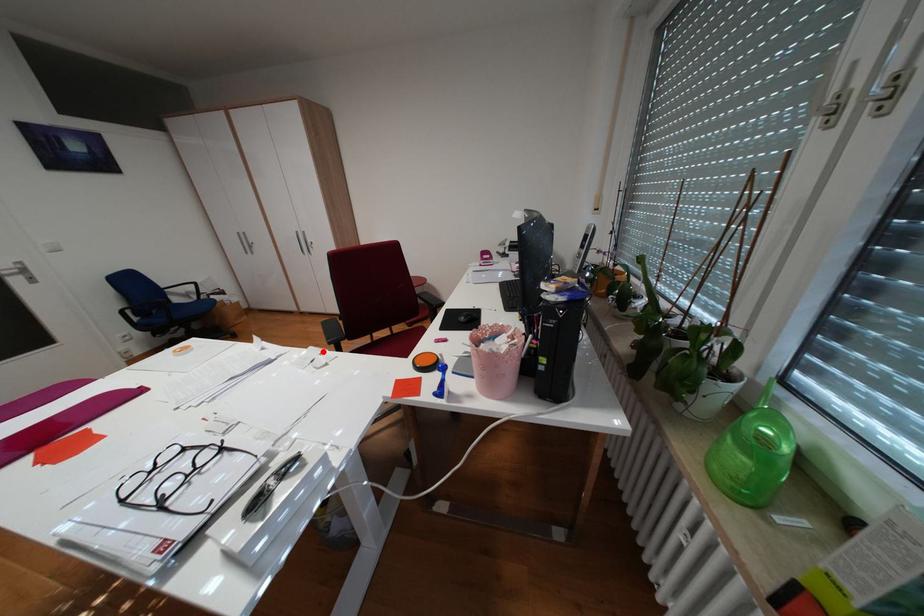
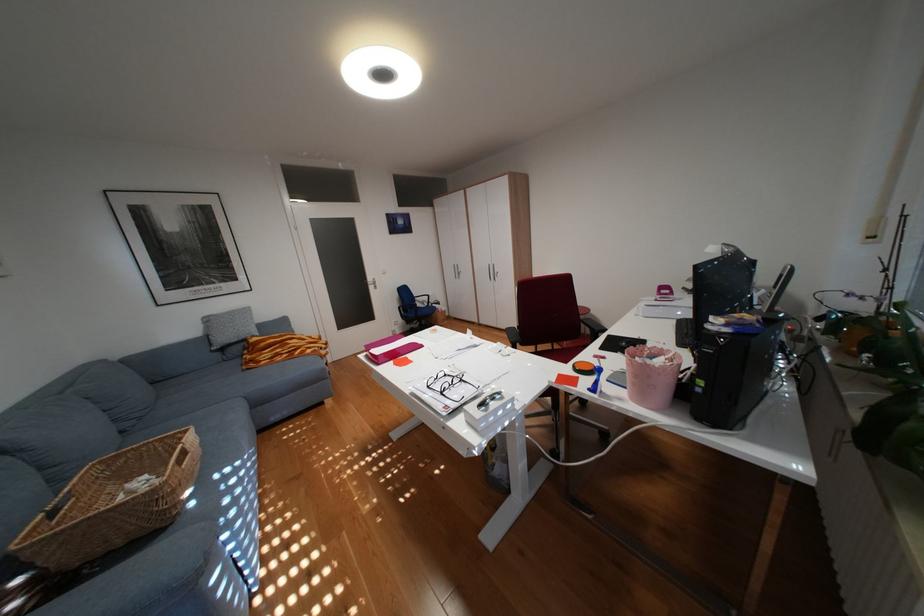
Question: I am providing you with two images of the same scene from different viewpoints. In image1, a red point is highlighted. Considering the same 3D point in image2, which of the following is correct?

Choices:
 (A) It is closer
 (B) It is farther

Answer: (B)